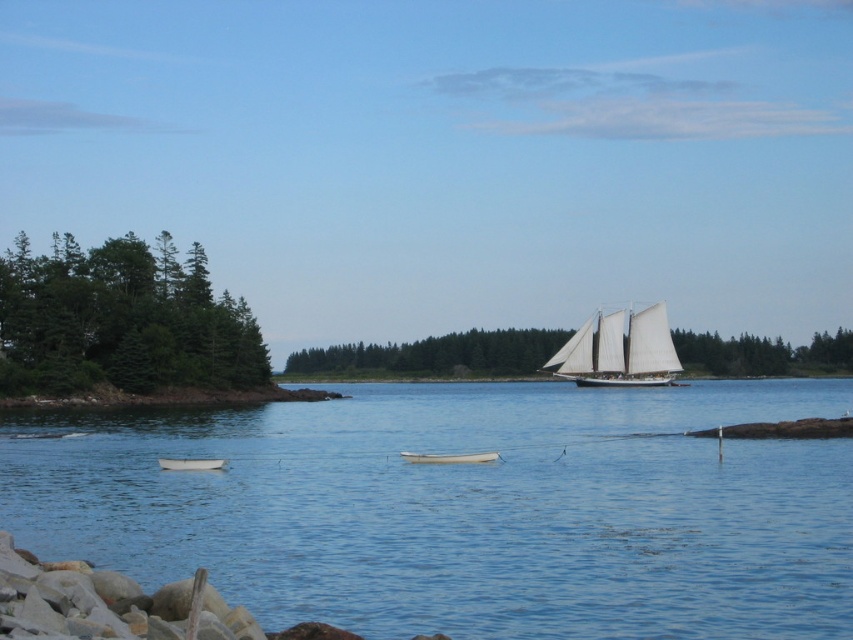
Question: Considering the relative positions of clear blue water at center and white canvas sailboat at center in the image provided, where is clear blue water at center located with respect to white canvas sailboat at center?

Choices:
 (A) below
 (B) above

Answer: (A)

Question: Is white canvas sailboat at center above white matte boat at center?

Choices:
 (A) yes
 (B) no

Answer: (A)

Question: Which point appears closest to the camera in this image?

Choices:
 (A) (651, 374)
 (B) (201, 461)
 (C) (285, 612)

Answer: (C)

Question: Does white canvas sailboat at center have a greater width compared to white matte rowboat at lower left?

Choices:
 (A) no
 (B) yes

Answer: (B)

Question: Which of the following is the closest to the observer?

Choices:
 (A) white canvas sailboat at center
 (B) white matte boat at center
 (C) white matte rowboat at lower left

Answer: (C)

Question: Which of the following is the farthest from the observer?

Choices:
 (A) white matte rowboat at lower left
 (B) white matte boat at center
 (C) clear blue water at center

Answer: (B)